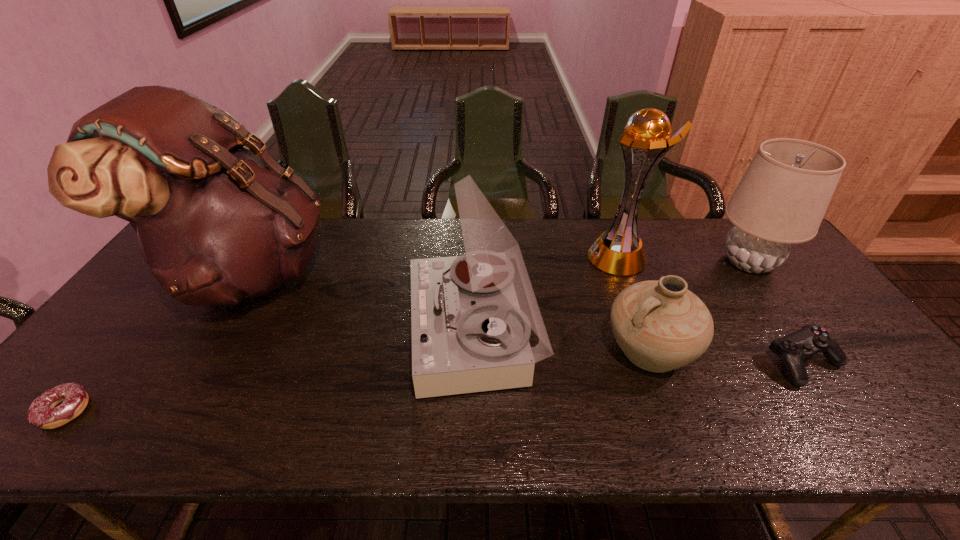
Where is `satchel`? satchel is located at coordinates (216, 222).

You are a GUI agent. You are given a task and a screenshot of the screen. Output one action in this format:
    pyautogui.click(x=<x>, y=<y>)
    Task: Click on the trophy
    The width and height of the screenshot is (960, 540).
    Given the screenshot: What is the action you would take?
    pyautogui.click(x=619, y=251)

At what (x,y) coordinates should I click in order to perform the action: click on lampshade. Please return your answer as a coordinate pair (x, y). This screenshot has width=960, height=540. Looking at the image, I should click on (782, 198).

Where is `the third object from left to right`? Image resolution: width=960 pixels, height=540 pixels. the third object from left to right is located at coordinates (471, 315).

Locate an element on the screen. Image resolution: width=960 pixels, height=540 pixels. the fifth tallest object is located at coordinates (660, 325).

At what (x,y) coordinates should I click in order to perform the action: click on control. Please return your answer as a coordinate pair (x, y). The image size is (960, 540). Looking at the image, I should click on (800, 345).

The image size is (960, 540). Find the location of `doughnut`. doughnut is located at coordinates (43, 413).

The image size is (960, 540). I want to click on free space located at the front of the satchel with buckles, so click(x=368, y=272).

Where is `free space located 0.230m on the front-facing side of the trophy`? This screenshot has width=960, height=540. free space located 0.230m on the front-facing side of the trophy is located at coordinates (516, 257).

This screenshot has width=960, height=540. Identify the location of free space located 0.080m on the front-facing side of the trophy. (563, 257).